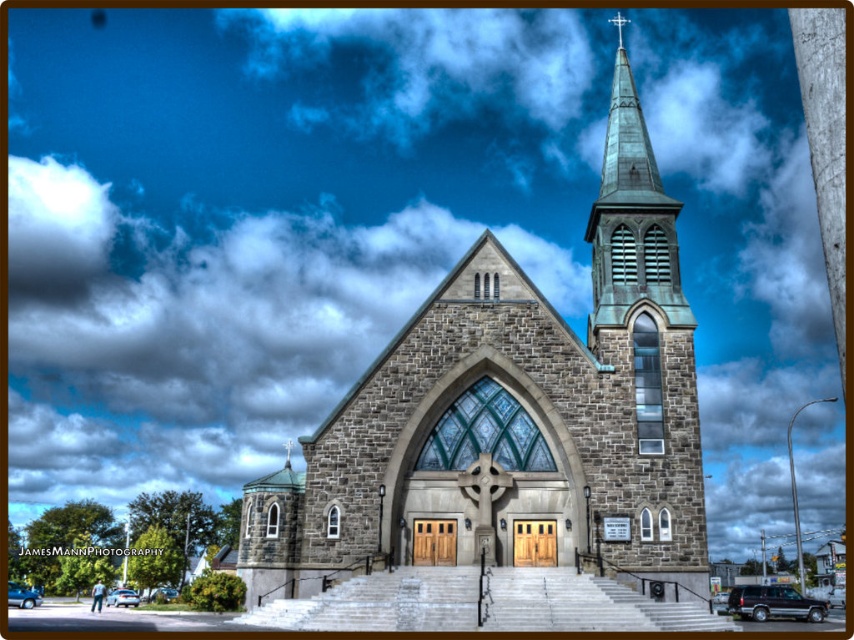
From the picture: Is gray stone church at center bigger than green copper spire at upper center?

Yes, gray stone church at center is bigger than green copper spire at upper center.

Who is more distant from viewer, (609, 444) or (618, 20)?

Point (618, 20)

The width and height of the screenshot is (854, 640). I want to click on gray stone church at center, so click(513, 419).

Does gray stone church at center have a lesser height compared to green copper steeple at upper right?

No, gray stone church at center is not shorter than green copper steeple at upper right.

Between gray stone church at center and green copper steeple at upper right, which one is positioned higher?

green copper steeple at upper right is above.

Is point (598, 557) in front of point (695, 410)?

Yes.

You are a GUI agent. You are given a task and a screenshot of the screen. Output one action in this format:
    pyautogui.click(x=<x>, y=<y>)
    Task: Click on the gray stone church at center
    This screenshot has width=854, height=640.
    Given the screenshot: What is the action you would take?
    pyautogui.click(x=513, y=419)

Can you confirm if green copper steeple at upper right is positioned to the left of green copper spire at upper center?

Indeed, green copper steeple at upper right is positioned on the left side of green copper spire at upper center.

Can you confirm if green copper steeple at upper right is taller than green copper spire at upper center?

Yes.

Is point (592, 205) closer to viewer compared to point (621, 35)?

That is False.

This screenshot has width=854, height=640. What are the coordinates of `green copper steeple at upper right` in the screenshot? It's located at (645, 356).